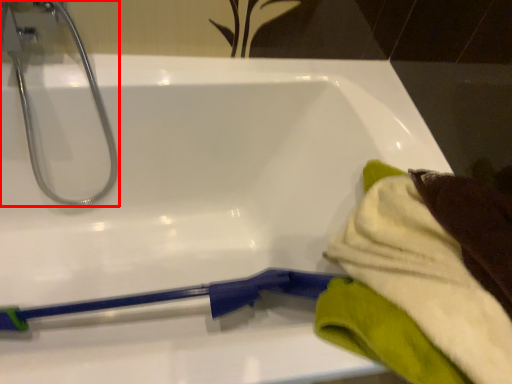
Question: From the image's perspective, considering the relative positions of tap (annotated by the red box) and bath towel in the image provided, where is tap (annotated by the red box) located with respect to the staircase?

Choices:
 (A) above
 (B) below

Answer: (A)